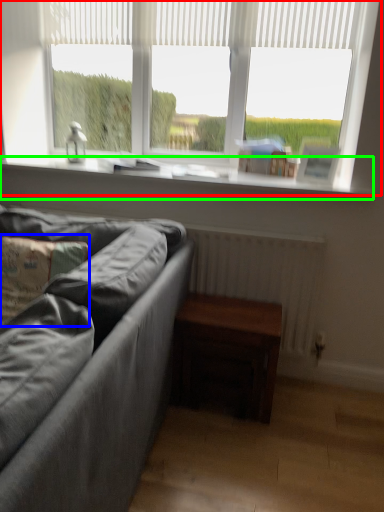
Question: Based on their relative distances, which object is nearer to window (highlighted by a red box)? Choose from pillow (highlighted by a blue box) and window sill (highlighted by a green box).

Choices:
 (A) pillow
 (B) window sill

Answer: (B)